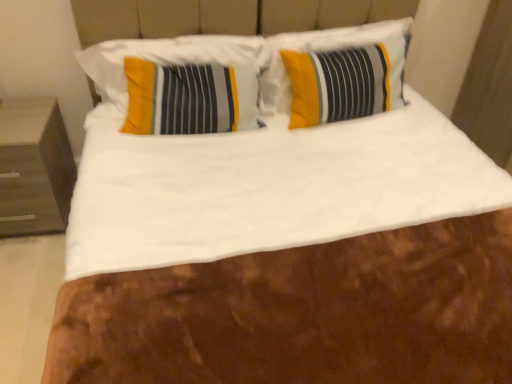
This screenshot has height=384, width=512. Find the location of `yellow striped pillow at upper left, the first pillow positioned from the left`. yellow striped pillow at upper left, the first pillow positioned from the left is located at coordinates (165, 58).

This screenshot has width=512, height=384. What are the coordinates of `dark wood nightstand at left` in the screenshot? It's located at (34, 167).

Is yellow fabric pillow at center, positioned as the 1th pillow in right-to-left order, looking in the opposite direction of dark wood nightstand at left?

yellow fabric pillow at center, positioned as the 1th pillow in right-to-left order, does not have its back to dark wood nightstand at left.

Is yellow fabric pillow at center, positioned as the 1th pillow in right-to-left order, with dark wood nightstand at left?

No.

Consider the image. Considering the relative sizes of yellow fabric pillow at center, positioned as the 1th pillow in right-to-left order, and dark wood nightstand at left in the image provided, is yellow fabric pillow at center, positioned as the 1th pillow in right-to-left order, thinner than dark wood nightstand at left?

Indeed, yellow fabric pillow at center, positioned as the 1th pillow in right-to-left order, has a lesser width compared to dark wood nightstand at left.

Choose the correct answer: Is yellow fabric pillow at center, positioned as the 1th pillow in right-to-left order, inside dark wood nightstand at left or outside it?

yellow fabric pillow at center, positioned as the 1th pillow in right-to-left order, cannot be found inside dark wood nightstand at left.

Considering the relative positions of yellow fabric pillow at center, marked as the second pillow in a left-to-right arrangement, and yellow striped pillow at upper left, the first pillow positioned from the left, in the image provided, is yellow fabric pillow at center, marked as the second pillow in a left-to-right arrangement, to the right of yellow striped pillow at upper left, the first pillow positioned from the left, from the viewer's perspective?

Indeed, yellow fabric pillow at center, marked as the second pillow in a left-to-right arrangement, is positioned on the right side of yellow striped pillow at upper left, the first pillow positioned from the left.

Between point (327, 44) and point (125, 88), which one is positioned in front?

The point (125, 88) is closer to the camera.

Which object is thinner, yellow fabric pillow at center, positioned as the 1th pillow in right-to-left order, or yellow striped pillow at upper left, the 2th pillow positioned from the right?

With smaller width is yellow striped pillow at upper left, the 2th pillow positioned from the right.

From the image's perspective, is yellow fabric pillow at center, positioned as the 1th pillow in right-to-left order, under yellow striped pillow at upper left, the first pillow positioned from the left?

Actually, yellow fabric pillow at center, positioned as the 1th pillow in right-to-left order, appears above yellow striped pillow at upper left, the first pillow positioned from the left, in the image.

Which point is more distant from viewer, (113,98) or (366,45)?

The point (366,45) is farther from the camera.

Can you confirm if yellow striped pillow at upper left, the first pillow positioned from the left, is shorter than yellow fabric pillow at center, positioned as the 1th pillow in right-to-left order?

Yes.

From the picture: Can you tell me how much yellow striped pillow at upper left, the 2th pillow positioned from the right, and yellow fabric pillow at center, marked as the second pillow in a left-to-right arrangement, differ in facing direction?

The angular difference between yellow striped pillow at upper left, the 2th pillow positioned from the right, and yellow fabric pillow at center, marked as the second pillow in a left-to-right arrangement, is 0.912 degrees.

Find the location of a particular element. The height and width of the screenshot is (384, 512). pillow above the yellow striped pillow at upper left, the first pillow positioned from the left (from the image's perspective) is located at coordinates (336, 68).

From a real-world perspective, which object rests below the other?

From a 3D spatial view, dark wood nightstand at left is below.

Is point (46, 107) farther from viewer compared to point (271, 101)?

That is False.

From the picture: Does dark wood nightstand at left turn towards yellow fabric pillow at center, positioned as the 1th pillow in right-to-left order?

No, dark wood nightstand at left is not aimed at yellow fabric pillow at center, positioned as the 1th pillow in right-to-left order.

From their relative heights in the image, would you say dark wood nightstand at left is taller or shorter than yellow striped pillow at upper left, the first pillow positioned from the left?

In the image, dark wood nightstand at left appears to be taller than yellow striped pillow at upper left, the first pillow positioned from the left.

Is dark wood nightstand at left positioned far away from yellow striped pillow at upper left, the first pillow positioned from the left?

No, there isn't a large distance between dark wood nightstand at left and yellow striped pillow at upper left, the first pillow positioned from the left.

Relative to yellow striped pillow at upper left, the first pillow positioned from the left, is dark wood nightstand at left in front or behind?

In the image, dark wood nightstand at left appears in front of yellow striped pillow at upper left, the first pillow positioned from the left.

Is point (48, 107) positioned before point (98, 53)?

No, it is not.

Considering the sizes of yellow striped pillow at upper left, the 2th pillow positioned from the right, and dark wood nightstand at left in the image, is yellow striped pillow at upper left, the 2th pillow positioned from the right, taller or shorter than dark wood nightstand at left?

yellow striped pillow at upper left, the 2th pillow positioned from the right, is shorter than dark wood nightstand at left.

Considering the sizes of objects yellow striped pillow at upper left, the first pillow positioned from the left, and dark wood nightstand at left in the image provided, who is smaller, yellow striped pillow at upper left, the first pillow positioned from the left, or dark wood nightstand at left?

Smaller between the two is yellow striped pillow at upper left, the first pillow positioned from the left.

Is yellow striped pillow at upper left, the 2th pillow positioned from the right, facing away from dark wood nightstand at left?

yellow striped pillow at upper left, the 2th pillow positioned from the right, is not turned away from dark wood nightstand at left.

At what (x,y) coordinates should I click in order to perform the action: click on nightstand that appears below the yellow fabric pillow at center, positioned as the 1th pillow in right-to-left order (from a real-world perspective). Please return your answer as a coordinate pair (x, y). The height and width of the screenshot is (384, 512). Looking at the image, I should click on (34, 167).

What are the coordinates of `pillow located below the yellow fabric pillow at center, marked as the second pillow in a left-to-right arrangement (from the image's perspective)` in the screenshot? It's located at 165,58.

When comparing their distances from yellow striped pillow at upper left, the first pillow positioned from the left, does yellow fabric pillow at center, marked as the second pillow in a left-to-right arrangement, or dark wood nightstand at left seem closer?

yellow fabric pillow at center, marked as the second pillow in a left-to-right arrangement, lies closer to yellow striped pillow at upper left, the first pillow positioned from the left, than the other object.

Looking at the image, which one is located closer to yellow fabric pillow at center, marked as the second pillow in a left-to-right arrangement, dark wood nightstand at left or yellow striped pillow at upper left, the first pillow positioned from the left?

The object closer to yellow fabric pillow at center, marked as the second pillow in a left-to-right arrangement, is yellow striped pillow at upper left, the first pillow positioned from the left.

Looking at the image, which one is located closer to dark wood nightstand at left, yellow striped pillow at upper left, the 2th pillow positioned from the right, or yellow fabric pillow at center, positioned as the 1th pillow in right-to-left order?

Among the two, yellow striped pillow at upper left, the 2th pillow positioned from the right, is located nearer to dark wood nightstand at left.

Estimate the real-world distances between objects in this image. Which object is further from yellow striped pillow at upper left, the 2th pillow positioned from the right, dark wood nightstand at left or yellow fabric pillow at center, positioned as the 1th pillow in right-to-left order?

dark wood nightstand at left lies further to yellow striped pillow at upper left, the 2th pillow positioned from the right, than the other object.

Considering their positions, is yellow striped pillow at upper left, the first pillow positioned from the left, positioned closer to yellow fabric pillow at center, positioned as the 1th pillow in right-to-left order, than dark wood nightstand at left?

yellow striped pillow at upper left, the first pillow positioned from the left.

From the image, which object appears to be farther from dark wood nightstand at left, yellow fabric pillow at center, marked as the second pillow in a left-to-right arrangement, or yellow striped pillow at upper left, the 2th pillow positioned from the right?

The object further to dark wood nightstand at left is yellow fabric pillow at center, marked as the second pillow in a left-to-right arrangement.

The height and width of the screenshot is (384, 512). Identify the location of pillow between dark wood nightstand at left and yellow fabric pillow at center, marked as the second pillow in a left-to-right arrangement, from left to right. pyautogui.click(x=165, y=58).